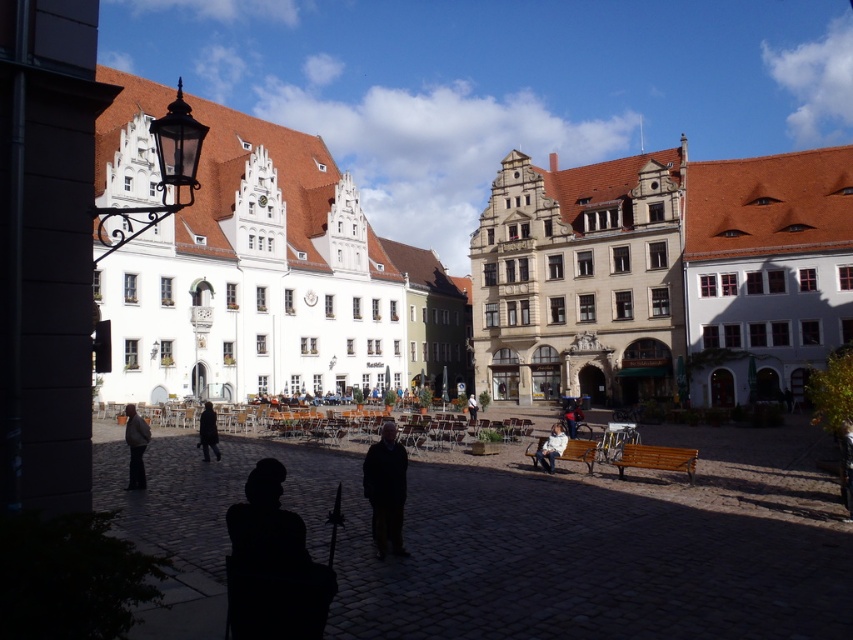
Does silhouette fabric at center appear on the left side of light brown wooden bench at lower right?

Yes, silhouette fabric at center is to the left of light brown wooden bench at lower right.

Locate an element on the screen. This screenshot has width=853, height=640. silhouette fabric at center is located at coordinates (271, 564).

You are a GUI agent. You are given a task and a screenshot of the screen. Output one action in this format:
    pyautogui.click(x=<x>, y=<y>)
    Task: Click on the silhouette fabric at center
    
    Given the screenshot: What is the action you would take?
    pyautogui.click(x=271, y=564)

Is point (190, 253) farther from camera compared to point (578, 412)?

Yes, point (190, 253) is farther from viewer.

Find the location of a particular element. This screenshot has width=853, height=640. white stone building at upper left is located at coordinates (488, 280).

The width and height of the screenshot is (853, 640). I want to click on dark gray jacket at lower left, so click(135, 445).

Identify the location of dark gray jacket at lower left. tap(135, 445).